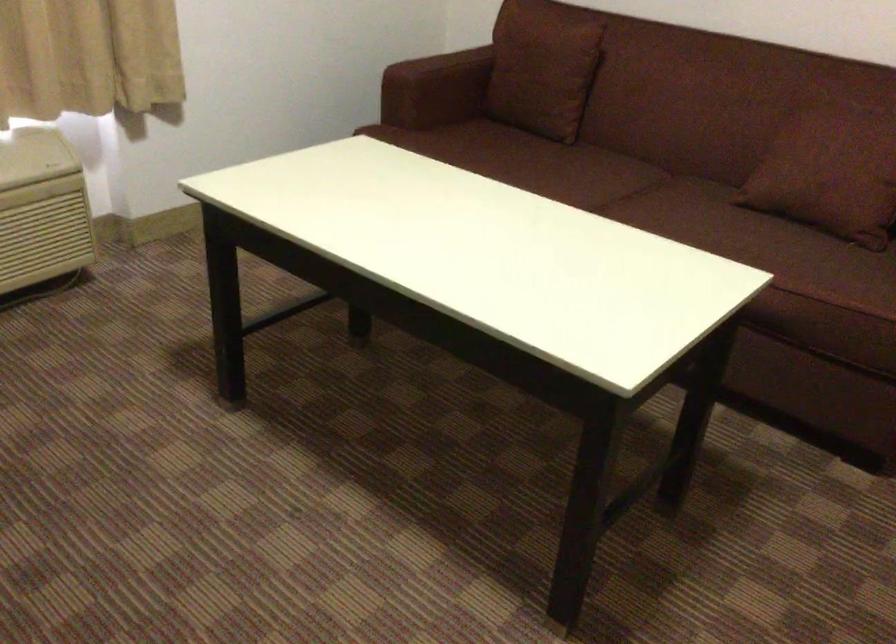
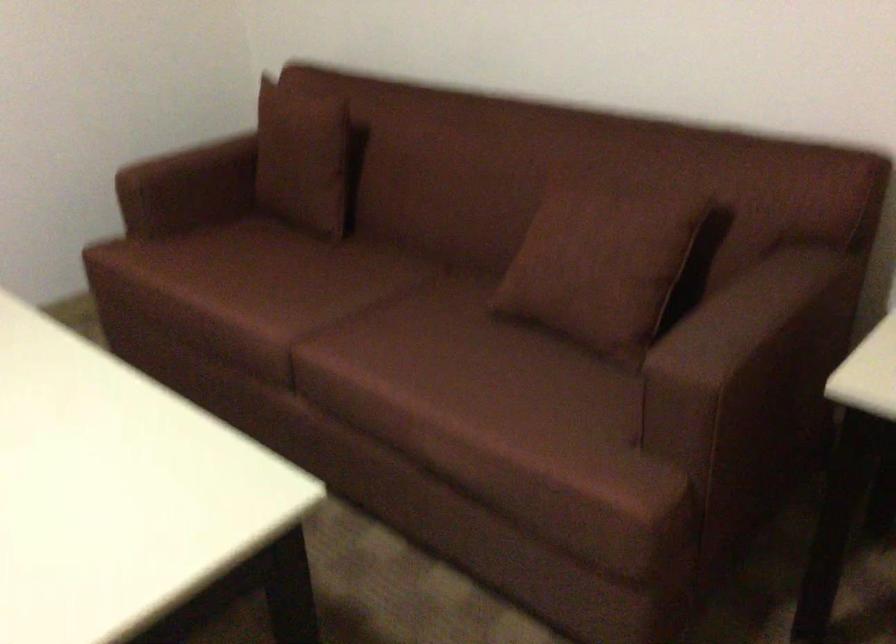
The images are taken continuously from a first-person perspective. In which direction are you moving?

The cameraman moved toward right, forward.